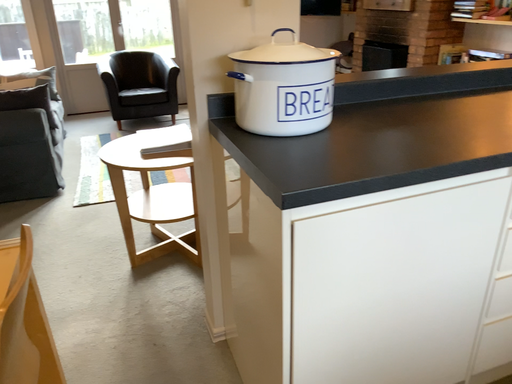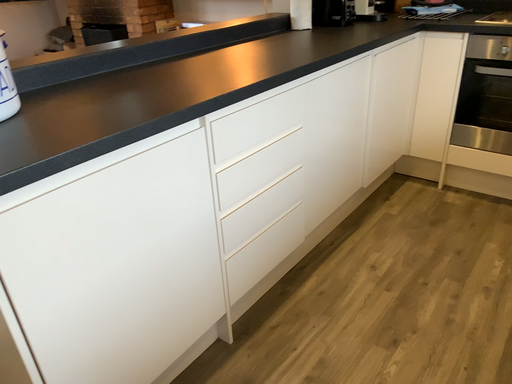
Question: How did the camera likely rotate when shooting the video?

Choices:
 (A) rotated right
 (B) rotated left

Answer: (A)